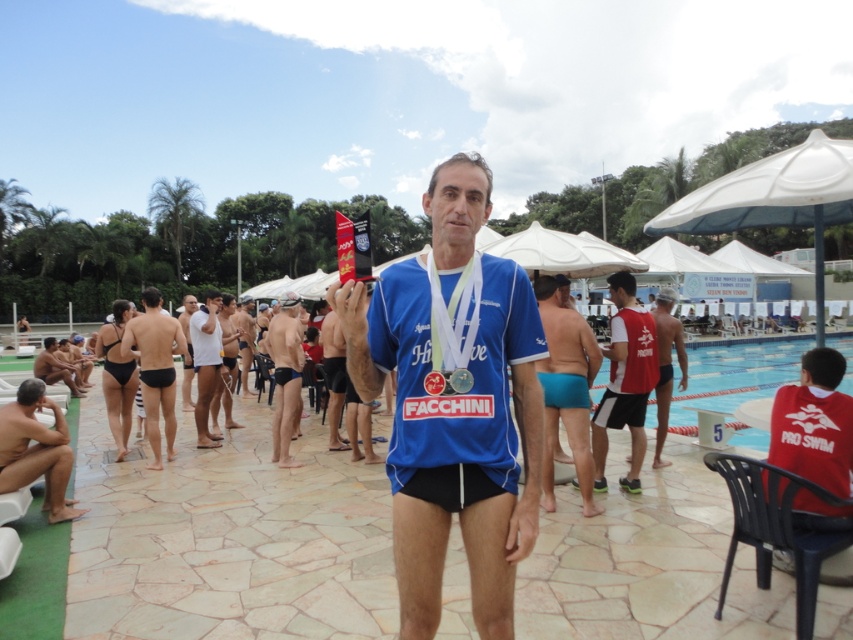
Does blue tile swimming pool at center come in front of white matte shorts at center?

Yes, it is in front of white matte shorts at center.

Can you confirm if blue tile swimming pool at center is wider than white matte shorts at center?

Yes, blue tile swimming pool at center is wider than white matte shorts at center.

Is point (753, 392) less distant than point (201, 368)?

No, (753, 392) is behind (201, 368).

You are a GUI agent. You are given a task and a screenshot of the screen. Output one action in this format:
    pyautogui.click(x=<x>, y=<y>)
    Task: Click on the blue tile swimming pool at center
    The height and width of the screenshot is (640, 853).
    Given the screenshot: What is the action you would take?
    pyautogui.click(x=735, y=374)

Which is behind, point (813, 387) or point (292, 356)?

The point (292, 356) is behind.

Can you confirm if red matte jersey at lower right is taller than matte blue swim trunks at center?

Incorrect, red matte jersey at lower right's height is not larger of matte blue swim trunks at center's.

Does point (831, 464) lie behind point (277, 449)?

No, it is in front of (277, 449).

The width and height of the screenshot is (853, 640). Find the location of `red matte jersey at lower right`. red matte jersey at lower right is located at coordinates (814, 422).

This screenshot has width=853, height=640. I want to click on blue tile swimming pool at center, so click(735, 374).

Does blue tile swimming pool at center have a greater width compared to matte black swim trunks at center?

Yes.

The height and width of the screenshot is (640, 853). Identify the location of blue tile swimming pool at center. (735, 374).